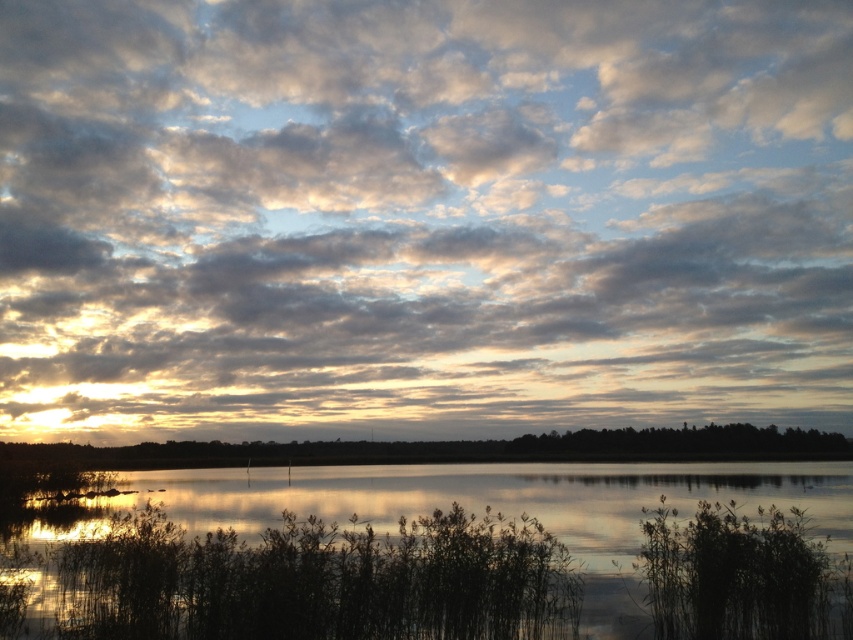
You are an artist trying to paint the scene. You want to ensure the cloudy sky at upper center and the transparent water at center are proportionally accurate. Which object should you paint taller in your painting?

The cloudy sky at upper center should be painted taller because it is much taller than the transparent water at center according to the description.